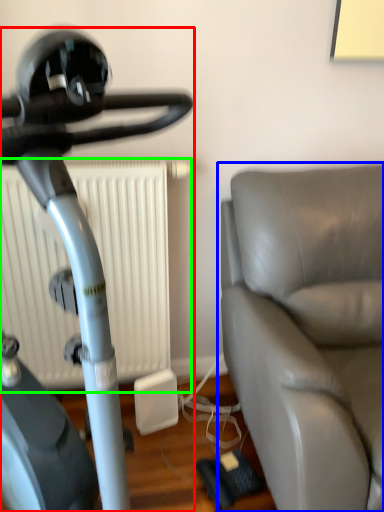
Question: Based on their relative distances, which object is farther from stationary bicycle (highlighted by a red box)? Choose from studio couch (highlighted by a blue box) and radiator (highlighted by a green box).

Choices:
 (A) studio couch
 (B) radiator

Answer: (B)